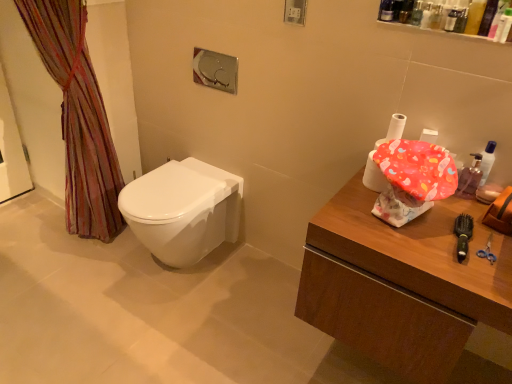
Where is `free space in front of multicolored fabric curtain at left`? The height and width of the screenshot is (384, 512). free space in front of multicolored fabric curtain at left is located at coordinates (70, 287).